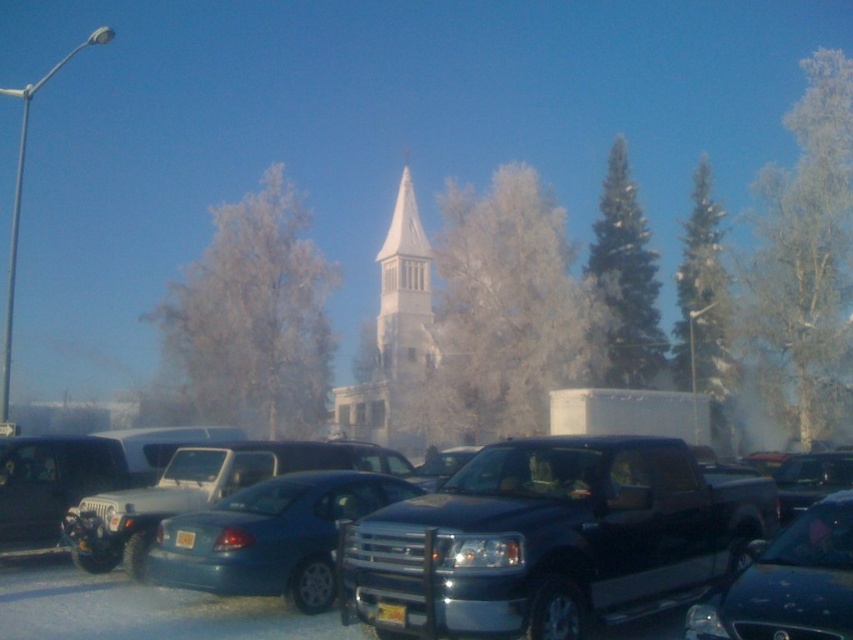
Between metallic blue sedan at center and shiny black sedan at center, which one appears on the right side from the viewer's perspective?

Positioned to the right is shiny black sedan at center.

Who is positioned more to the left, metallic blue sedan at center or shiny black sedan at center?

metallic blue sedan at center is more to the left.

Is point (248, 560) farther from camera compared to point (802, 563)?

Yes, point (248, 560) is farther from viewer.

What are the coordinates of `metallic blue sedan at center` in the screenshot? It's located at (270, 536).

Is blue metallic sedan at center bigger than shiny black sedan at center?

No.

Is blue metallic sedan at center further to camera compared to shiny black sedan at center?

Yes, it is.

Locate an element on the screen. The height and width of the screenshot is (640, 853). blue metallic sedan at center is located at coordinates (201, 492).

You are a GUI agent. You are given a task and a screenshot of the screen. Output one action in this format:
    pyautogui.click(x=<x>, y=<y>)
    Task: Click on the blue metallic sedan at center
    
    Given the screenshot: What is the action you would take?
    201,492

Can you confirm if metallic blue sedan at center is shorter than shiny black truck at center?

No, metallic blue sedan at center is not shorter than shiny black truck at center.

Where is `metallic blue sedan at center`? metallic blue sedan at center is located at coordinates (270, 536).